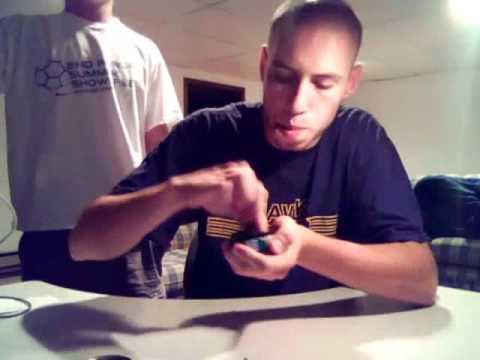
The width and height of the screenshot is (480, 360). Identify the location of grey heating element. (7, 262).